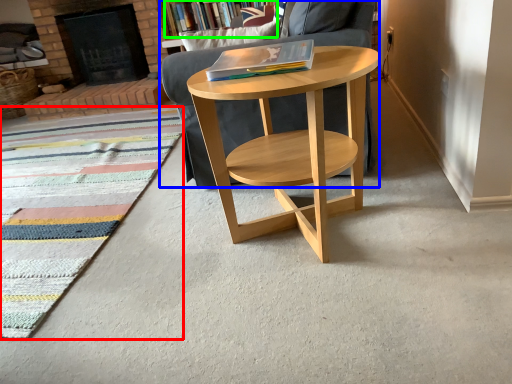
Question: Based on their relative distances, which object is nearer to mat (highlighted by a red box)? Choose from chair (highlighted by a blue box) and bookcase (highlighted by a green box).

Choices:
 (A) chair
 (B) bookcase

Answer: (A)